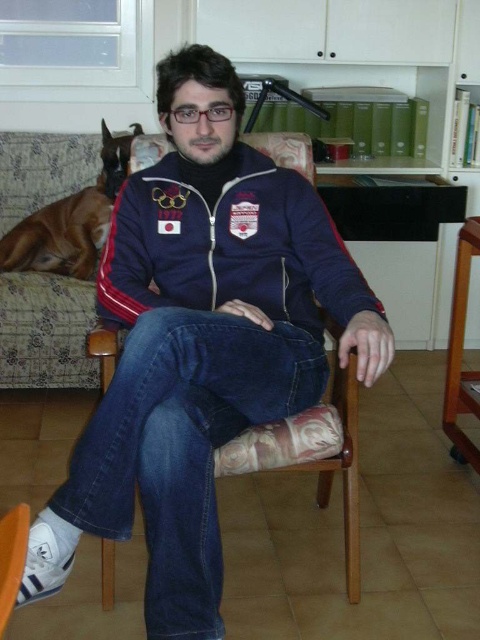
You are a photographer taking a picture of the person sitting on the wooden chair with a floral patterned cushion. The camera you are using has a focus point at coordinate point (228,244). According to the image, what object will be in focus at that point?

The point (228,244) is on the navy blue fleece sweatshirt at center, so the focus will be on the navy blue fleece sweatshirt at center.